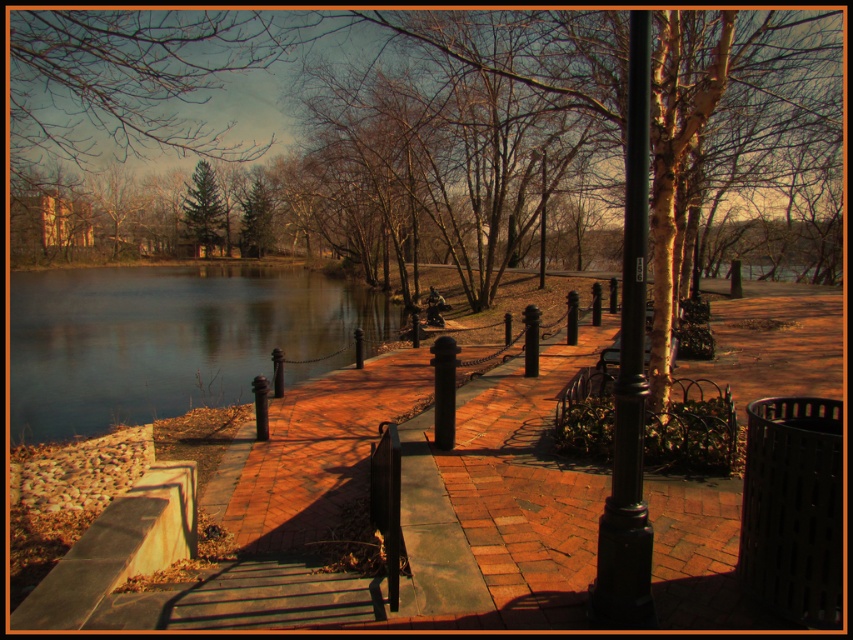
Question: Which of the following is the closest to the observer?

Choices:
 (A) (140, 51)
 (B) (646, 84)

Answer: (B)

Question: Is black metal pole at center behind green matte tree at center?

Choices:
 (A) yes
 (B) no

Answer: (B)

Question: Does black metal pole at center come in front of green textured pine tree at upper center?

Choices:
 (A) yes
 (B) no

Answer: (A)

Question: Can you confirm if green matte tree at upper center is positioned to the right of metallic pole at center?

Choices:
 (A) no
 (B) yes

Answer: (A)

Question: Estimate the real-world distances between objects in this image. Which object is closer to the black metal pole at center?

Choices:
 (A) green textured pine tree at upper center
 (B) green matte tree at upper center
 (C) green matte tree at center
 (D) smooth water at center

Answer: (B)

Question: Which of the following is the closest to the observer?

Choices:
 (A) (543, 230)
 (B) (253, 228)
 (C) (207, 211)

Answer: (A)